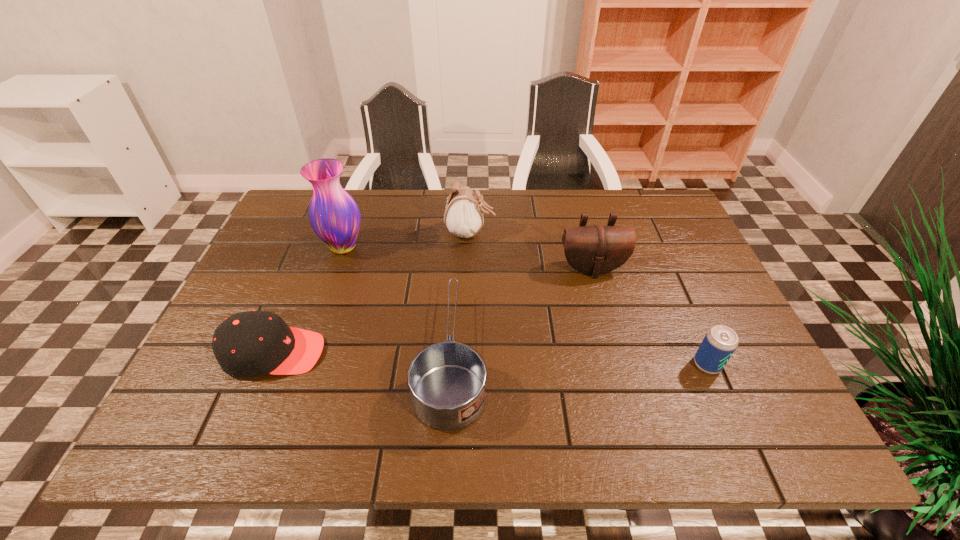
Locate an element on the screen. Image resolution: width=960 pixels, height=540 pixels. free space between the vase and the left pouch is located at coordinates (407, 240).

Where is `free space between the rightmost object and the vase`? This screenshot has width=960, height=540. free space between the rightmost object and the vase is located at coordinates (525, 306).

This screenshot has height=540, width=960. What are the coordinates of `vacant area between the tallest object and the farther pouch` in the screenshot? It's located at (407, 240).

In order to click on unoccupied position between the cap and the rightmost object in this screenshot , I will do `click(491, 359)`.

Locate an element on the screen. The image size is (960, 540). vacant region between the tallest object and the beer can is located at coordinates (525, 306).

Find the location of a particular element. This screenshot has height=540, width=960. free area in between the cap and the fifth object from left to right is located at coordinates (433, 310).

Find the location of a particular element. free spot between the nearer pouch and the farther pouch is located at coordinates (531, 251).

Identify which object is the fourth nearest to the farther pouch. Please provide its 2D coordinates. Your answer should be formatted as a tuple, i.e. [(x, y)], where the tuple contains the x and y coordinates of a point satisfying the conditions above.

[(252, 343)]

This screenshot has height=540, width=960. What are the coordinates of `object that is the closest to the rightmost object` in the screenshot? It's located at (594, 250).

What are the coordinates of `free space that satisfies the following two spatial constraints: 1. on the front-facing side of the rightmost object; 2. on the right side of the farther pouch` in the screenshot? It's located at (467, 364).